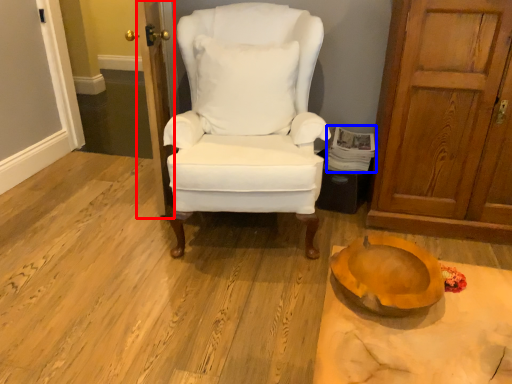
Question: Among these objects, which one is farthest to the camera, door (highlighted by a red box) or magazine (highlighted by a blue box)?

Choices:
 (A) door
 (B) magazine

Answer: (B)